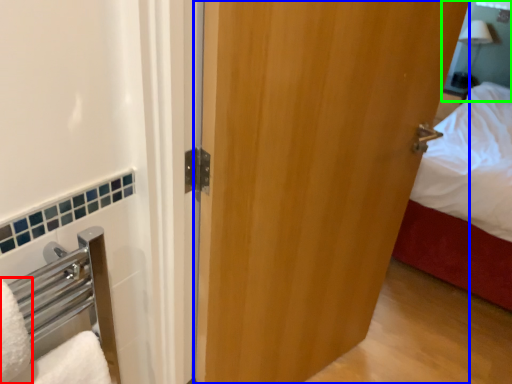
Question: Considering the real-world distances, which object is farthest from bath towel (highlighted by a red box)? door (highlighted by a blue box) or mirror (highlighted by a green box)?

Choices:
 (A) door
 (B) mirror

Answer: (B)